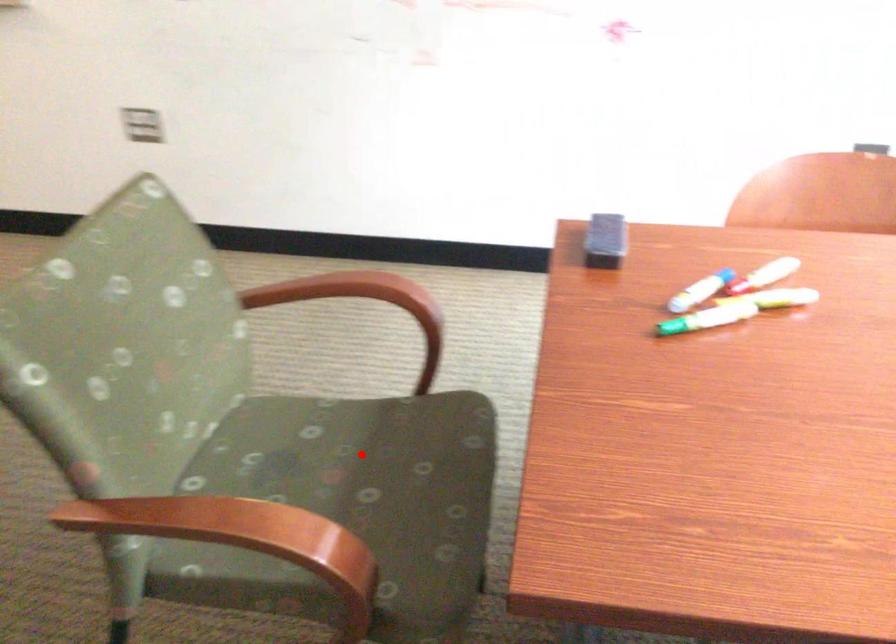
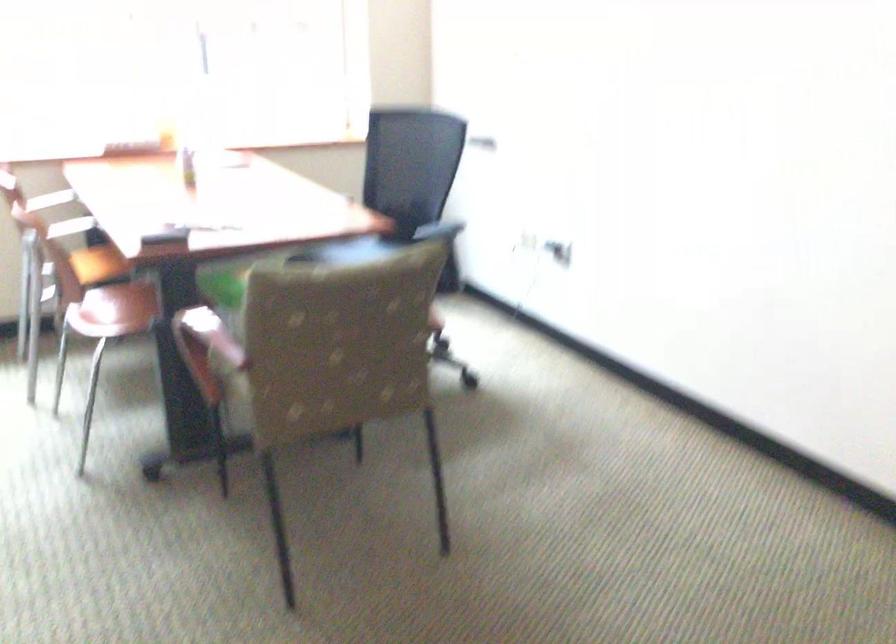
Question: I am providing you with two images of the same scene from different viewpoints. A red point is marked on the first image. At the location where the point appears in image 1, is it still visible in image 2?

Choices:
 (A) Yes
 (B) No

Answer: (B)